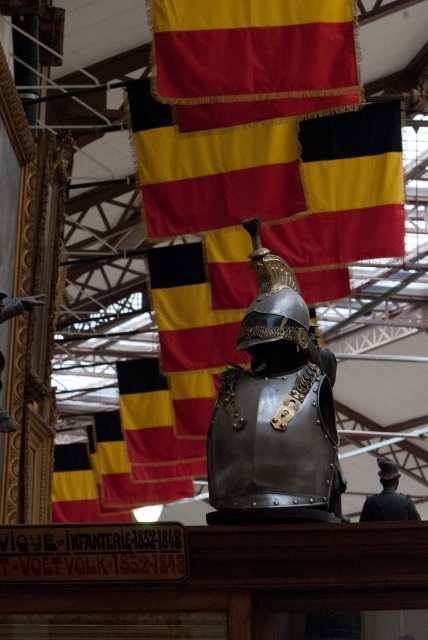
Is yellow-black checkered fabric at center smaller than yellow-black flag at lower left?

Correct, yellow-black checkered fabric at center occupies less space than yellow-black flag at lower left.

Who is shorter, yellow-black checkered fabric at center or yellow-black flag at lower left?

With less height is yellow-black flag at lower left.

The height and width of the screenshot is (640, 428). What do you see at coordinates (154, 426) in the screenshot? I see `yellow-black checkered fabric at center` at bounding box center [154, 426].

Find the location of a particular element. The image size is (428, 640). yellow-black checkered fabric at center is located at coordinates (154, 426).

Is yellow/red/black fabric at center closer to camera compared to red fabric flag at upper center?

No.

Can you confirm if yellow/red/black fabric at center is shorter than red fabric flag at upper center?

Incorrect, yellow/red/black fabric at center's height does not fall short of red fabric flag at upper center's.

Identify the location of yellow/red/black fabric at center. The width and height of the screenshot is (428, 640). (278, 180).

The width and height of the screenshot is (428, 640). Describe the element at coordinates (278, 180) in the screenshot. I see `yellow/red/black fabric at center` at that location.

In the scene shown: Does yellow/red/black fabric at center come behind black and yellow fabric flag at center?

No, it is not.

Where is `yellow/red/black fabric at center`? The height and width of the screenshot is (640, 428). yellow/red/black fabric at center is located at coordinates (278, 180).